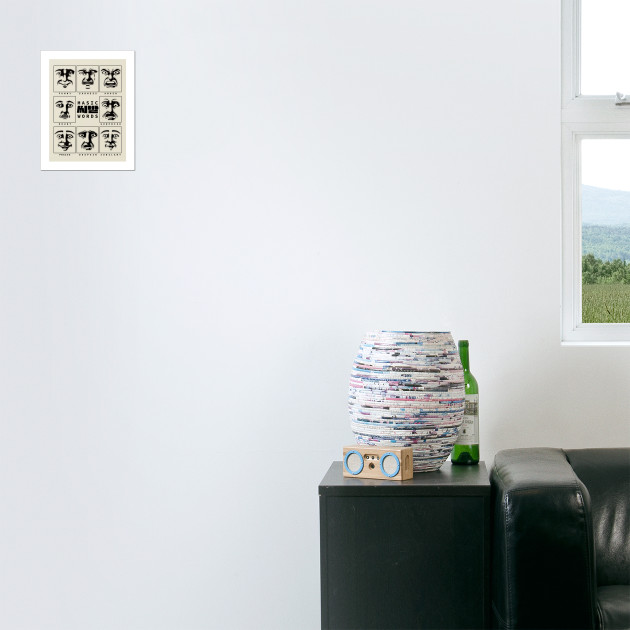
Where is `the top and bottom of white patterned vase`? the top and bottom of white patterned vase is located at coordinates (410, 329), (421, 474).